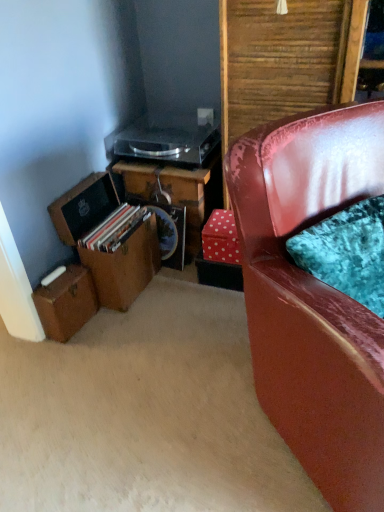
The height and width of the screenshot is (512, 384). What do you see at coordinates (174, 193) in the screenshot?
I see `wooden desk at center` at bounding box center [174, 193].

This screenshot has height=512, width=384. In order to click on red polka dot cardboard box at lower right in this screenshot , I will do `click(221, 238)`.

This screenshot has height=512, width=384. Find the location of `brown leather suitcase at lower left, which ranks as the 1th box in bottom-to-top order`. brown leather suitcase at lower left, which ranks as the 1th box in bottom-to-top order is located at coordinates (66, 303).

You are a GUI agent. You are given a task and a screenshot of the screen. Output one action in this format:
    pyautogui.click(x=<x>, y=<y>)
    Task: Click on the shiny red leather chair at right
    Image resolution: width=384 pixels, height=512 pixels.
    Given the screenshot: What is the action you would take?
    pyautogui.click(x=313, y=296)

Between wooden desk at center and transparent plastic record player at upper center, which one has smaller width?

With smaller width is wooden desk at center.

How many degrees apart are the facing directions of wooden desk at center and transparent plastic record player at upper center?

The facing directions of wooden desk at center and transparent plastic record player at upper center are 0.182 degrees apart.

Which is in front, wooden desk at center or transparent plastic record player at upper center?

transparent plastic record player at upper center.

Is wooden desk at center inside or outside of transparent plastic record player at upper center?

wooden desk at center lies outside transparent plastic record player at upper center.

Consider the image. From a real-world perspective, is transparent plastic record player at upper center under brown leather suitcase at lower left, which ranks as the 1th box in bottom-to-top order?

No, from a real-world perspective, transparent plastic record player at upper center is not beneath brown leather suitcase at lower left, which ranks as the 1th box in bottom-to-top order.

Which is more to the left, transparent plastic record player at upper center or brown leather suitcase at lower left, which ranks as the 1th box in bottom-to-top order?

Positioned to the left is brown leather suitcase at lower left, which ranks as the 1th box in bottom-to-top order.

Which is more distant, [161,118] or [79,303]?

Point [161,118]

How much distance is there between transparent plastic record player at upper center and brown leather suitcase at lower left, which ranks as the 1th box in bottom-to-top order?

transparent plastic record player at upper center is 74.50 centimeters away from brown leather suitcase at lower left, which ranks as the 1th box in bottom-to-top order.

Where is `box located on the left of brown leather suitcase at lower left, the second box from the bottom`? box located on the left of brown leather suitcase at lower left, the second box from the bottom is located at coordinates (66, 303).

How many degrees apart are the facing directions of brown leather suitcase at lower left, which appears as the 2th box when viewed from the top, and brown leather suitcase at lower left, the first box viewed from the top?

The facing directions of brown leather suitcase at lower left, which appears as the 2th box when viewed from the top, and brown leather suitcase at lower left, the first box viewed from the top, are 3.13 degrees apart.

From a real-world perspective, which is physically above, brown leather suitcase at lower left, which ranks as the 1th box in bottom-to-top order, or brown leather suitcase at lower left, the first box viewed from the top?

brown leather suitcase at lower left, the first box viewed from the top, from a real-world perspective.

Which object is positioned more to the right, brown leather suitcase at lower left, the second box from the bottom, or brown leather suitcase at lower left, which appears as the 2th box when viewed from the top?

brown leather suitcase at lower left, the second box from the bottom.

In terms of height, does brown leather suitcase at lower left, the second box from the bottom, look taller or shorter compared to brown leather suitcase at lower left, which appears as the 2th box when viewed from the top?

In the image, brown leather suitcase at lower left, the second box from the bottom, appears to be taller than brown leather suitcase at lower left, which appears as the 2th box when viewed from the top.

From a real-world perspective, is brown leather suitcase at lower left, the second box from the bottom, positioned above or below brown leather suitcase at lower left, which appears as the 2th box when viewed from the top?

From a real-world perspective, brown leather suitcase at lower left, the second box from the bottom, is physically above brown leather suitcase at lower left, which appears as the 2th box when viewed from the top.

Are red polka dot cardboard box at lower right and transparent plastic record player at upper center beside each other?

No, red polka dot cardboard box at lower right is not next to transparent plastic record player at upper center.

Considering the sizes of red polka dot cardboard box at lower right and transparent plastic record player at upper center in the image, is red polka dot cardboard box at lower right taller or shorter than transparent plastic record player at upper center?

Considering their sizes, red polka dot cardboard box at lower right has more height than transparent plastic record player at upper center.

Would you say red polka dot cardboard box at lower right contains transparent plastic record player at upper center?

Actually, transparent plastic record player at upper center is outside red polka dot cardboard box at lower right.

Image resolution: width=384 pixels, height=512 pixels. I want to click on cardboard box below the transparent plastic record player at upper center (from the image's perspective), so click(x=221, y=238).

Considering the relative sizes of red polka dot cardboard box at lower right and brown leather suitcase at lower left, the first box viewed from the top, in the image provided, is red polka dot cardboard box at lower right smaller than brown leather suitcase at lower left, the first box viewed from the top,?

Yes.

Which of these two, red polka dot cardboard box at lower right or brown leather suitcase at lower left, the first box viewed from the top, stands shorter?

red polka dot cardboard box at lower right is shorter.

How many degrees apart are the facing directions of red polka dot cardboard box at lower right and brown leather suitcase at lower left, the second box from the bottom?

There is a 85.4-degree angle between the facing directions of red polka dot cardboard box at lower right and brown leather suitcase at lower left, the second box from the bottom.

Are wooden desk at center and brown leather suitcase at lower left, the first box viewed from the top, beside each other?

No, wooden desk at center is not beside brown leather suitcase at lower left, the first box viewed from the top.

Between wooden desk at center and brown leather suitcase at lower left, the second box from the bottom, which one has smaller size?

brown leather suitcase at lower left, the second box from the bottom, is smaller.

Find the location of `desk above the brown leather suitcase at lower left, the second box from the bottom (from the image's perspective)`. desk above the brown leather suitcase at lower left, the second box from the bottom (from the image's perspective) is located at coordinates (174, 193).

Which is closer, (159, 189) or (76, 240)?

Positioned in front is point (76, 240).

Identify the location of appliance on the left of wooden desk at center. The height and width of the screenshot is (512, 384). (168, 140).

This screenshot has width=384, height=512. I want to click on the 1st box in front of the transparent plastic record player at upper center, so point(66,303).

From the image, which object appears to be farther from red polka dot cardboard box at lower right, shiny red leather chair at right or brown leather suitcase at lower left, the second box from the bottom?

shiny red leather chair at right is positioned further to the anchor red polka dot cardboard box at lower right.

Which object lies further to the anchor point red polka dot cardboard box at lower right, transparent plastic record player at upper center or shiny red leather chair at right?

shiny red leather chair at right is positioned further to the anchor red polka dot cardboard box at lower right.

Estimate the real-world distances between objects in this image. Which object is closer to brown leather suitcase at lower left, which ranks as the 1th box in bottom-to-top order, transparent plastic record player at upper center or shiny red leather chair at right?

transparent plastic record player at upper center is closer to brown leather suitcase at lower left, which ranks as the 1th box in bottom-to-top order.

Looking at the image, which one is located closer to brown leather suitcase at lower left, the second box from the bottom, wooden desk at center or transparent plastic record player at upper center?

wooden desk at center lies closer to brown leather suitcase at lower left, the second box from the bottom, than the other object.

Estimate the real-world distances between objects in this image. Which object is closer to shiny red leather chair at right, red polka dot cardboard box at lower right or brown leather suitcase at lower left, which ranks as the 1th box in bottom-to-top order?

red polka dot cardboard box at lower right is closer to shiny red leather chair at right.

Considering their positions, is brown leather suitcase at lower left, the first box viewed from the top, positioned closer to shiny red leather chair at right than brown leather suitcase at lower left, which ranks as the 1th box in bottom-to-top order?

brown leather suitcase at lower left, the first box viewed from the top.

Which object lies further to the anchor point brown leather suitcase at lower left, the second box from the bottom, shiny red leather chair at right or brown leather suitcase at lower left, which appears as the 2th box when viewed from the top?

Among the two, shiny red leather chair at right is located further to brown leather suitcase at lower left, the second box from the bottom.

Based on their spatial positions, is brown leather suitcase at lower left, which ranks as the 1th box in bottom-to-top order, or brown leather suitcase at lower left, the first box viewed from the top, further from red polka dot cardboard box at lower right?

The object further to red polka dot cardboard box at lower right is brown leather suitcase at lower left, which ranks as the 1th box in bottom-to-top order.

Locate an element on the screen. The height and width of the screenshot is (512, 384). desk between brown leather suitcase at lower left, which ranks as the 1th box in bottom-to-top order, and red polka dot cardboard box at lower right from left to right is located at coordinates (174, 193).

You are a GUI agent. You are given a task and a screenshot of the screen. Output one action in this format:
    pyautogui.click(x=<x>, y=<y>)
    Task: Click on the desk between transparent plastic record player at upper center and brown leather suitcase at lower left, which appears as the 2th box when viewed from the top, from top to bottom
    
    Given the screenshot: What is the action you would take?
    pyautogui.click(x=174, y=193)

This screenshot has height=512, width=384. What are the coordinates of `cardboard box between shiny red leather chair at right and wooden desk at center from front to back` in the screenshot? It's located at (221, 238).

What are the coordinates of `box between brown leather suitcase at lower left, which appears as the 2th box when viewed from the top, and red polka dot cardboard box at lower right` in the screenshot? It's located at (124, 267).